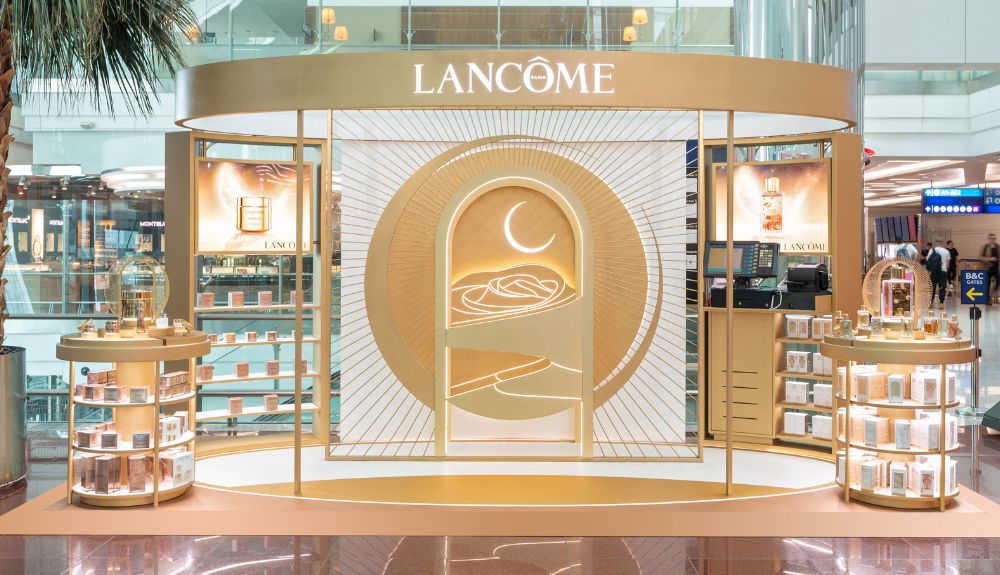
Find the location of `lights`. lights is located at coordinates (257, 206), (768, 203).